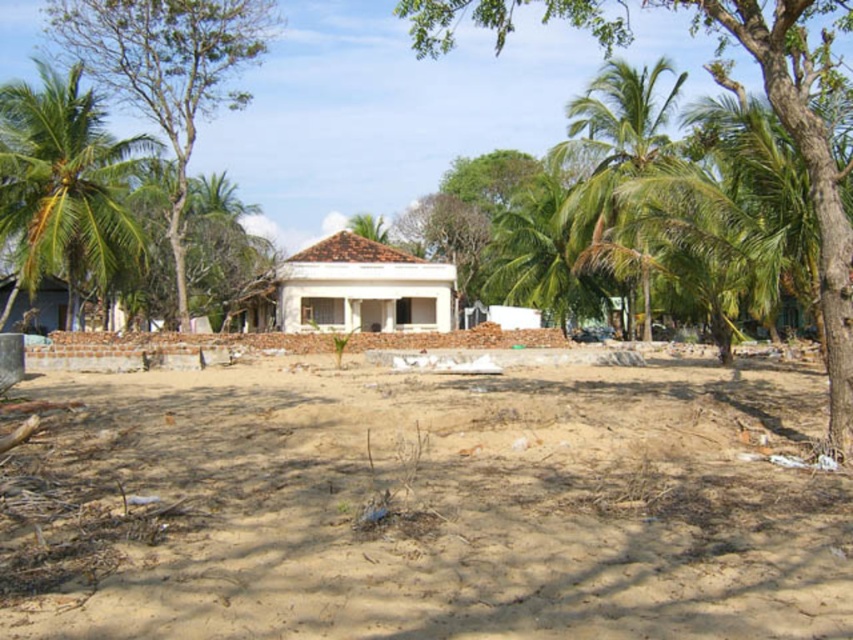
You are standing in front of the white building with a red roof and want to walk to the green leafy palm tree at center. Which path should you take to reach it without crossing the brown sandy dirt field at center?

You should walk around the brown sandy dirt field at center since it is closer to you than the green leafy palm tree at center, so you can go around it to reach the tree.

You are standing at the entrance of the white building with a red roof and want to reach the green leafy tree at left. Which direction should you walk to get there?

The green leafy tree at left is located at point (167, 70), so you should walk towards the left side from the building to reach it.

You are standing at the point marked by point (363,288) in the image. What object are you directly facing?

You are directly facing the white matte house at center as the point (363,288) marks its location.